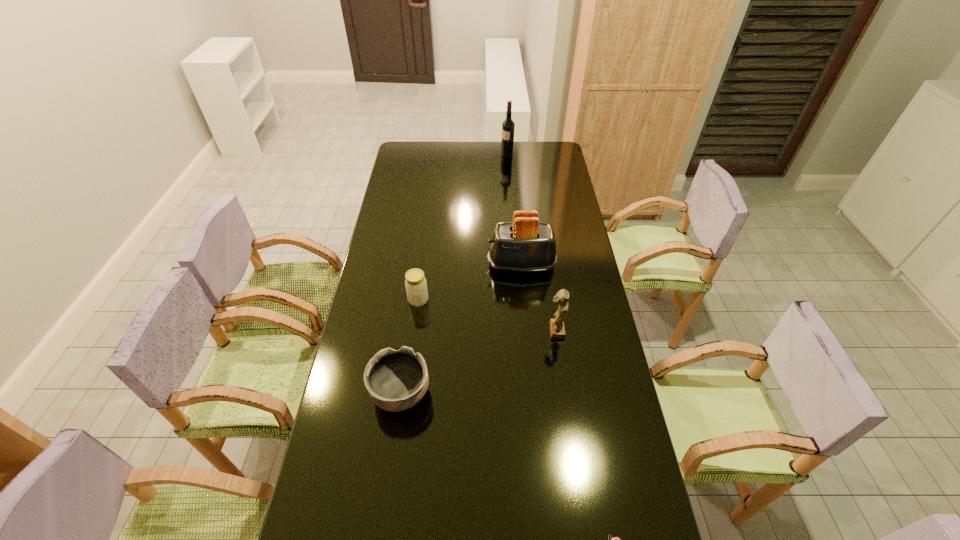
This screenshot has width=960, height=540. Find the location of `free space between the fifth farthest object and the jar`. free space between the fifth farthest object and the jar is located at coordinates (410, 347).

Where is `free spot between the second nearest object and the toaster`? This screenshot has width=960, height=540. free spot between the second nearest object and the toaster is located at coordinates (461, 329).

Where is `free space between the fifth nearest object and the fourth farthest object`? The width and height of the screenshot is (960, 540). free space between the fifth nearest object and the fourth farthest object is located at coordinates (539, 298).

At what (x,y) coordinates should I click in order to perform the action: click on blank region between the wine bottle and the fourth nearest object. Please return your answer as a coordinate pair (x, y). Looking at the image, I should click on (463, 228).

At what (x,y) coordinates should I click in order to perform the action: click on object identified as the second closest to the third nearest object. Please return your answer as a coordinate pair (x, y). Looking at the image, I should click on [x=396, y=381].

Select which object is the second closest to the shortest object. Please provide its 2D coordinates. Your answer should be formatted as a tuple, i.e. [(x, y)], where the tuple contains the x and y coordinates of a point satisfying the conditions above.

[(557, 329)]

At what (x,y) coordinates should I click in order to perform the action: click on vacant space that satisfies the following two spatial constraints: 1. on the side of the second tallest object with the control lever; 2. on the front side of the second nearest object. Please return your answer as a coordinate pair (x, y). This screenshot has height=540, width=960. Looking at the image, I should click on (533, 394).

The height and width of the screenshot is (540, 960). I want to click on free point that satisfies the following two spatial constraints: 1. on the front-facing side of the third tallest object; 2. on the front side of the pottery, so click(565, 394).